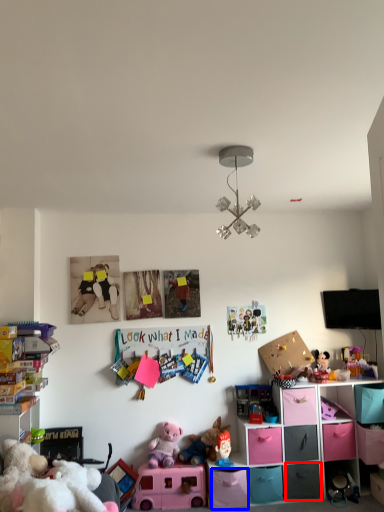
Question: Which object is further to the camera taking this photo, drawer (highlighted by a red box) or drawer (highlighted by a blue box)?

Choices:
 (A) drawer
 (B) drawer

Answer: (A)